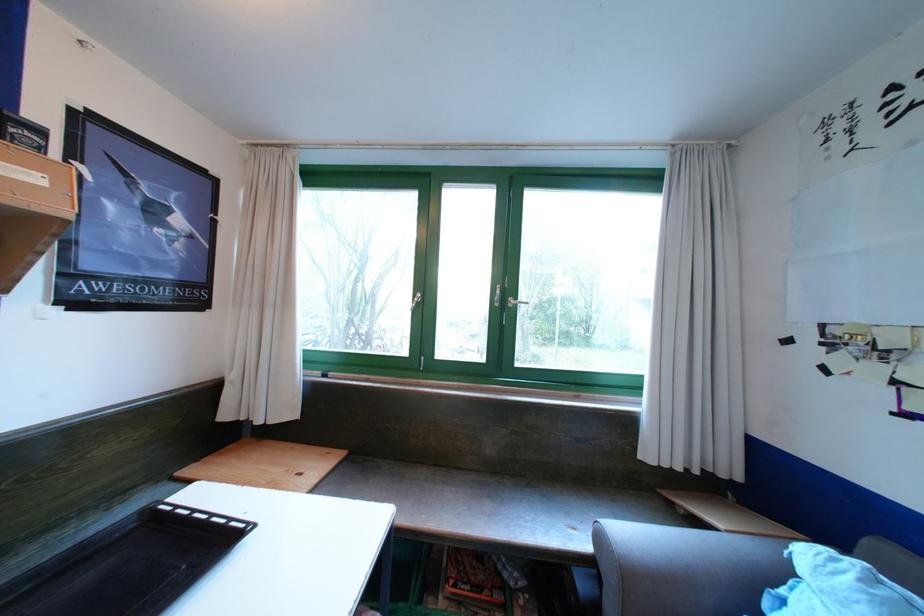
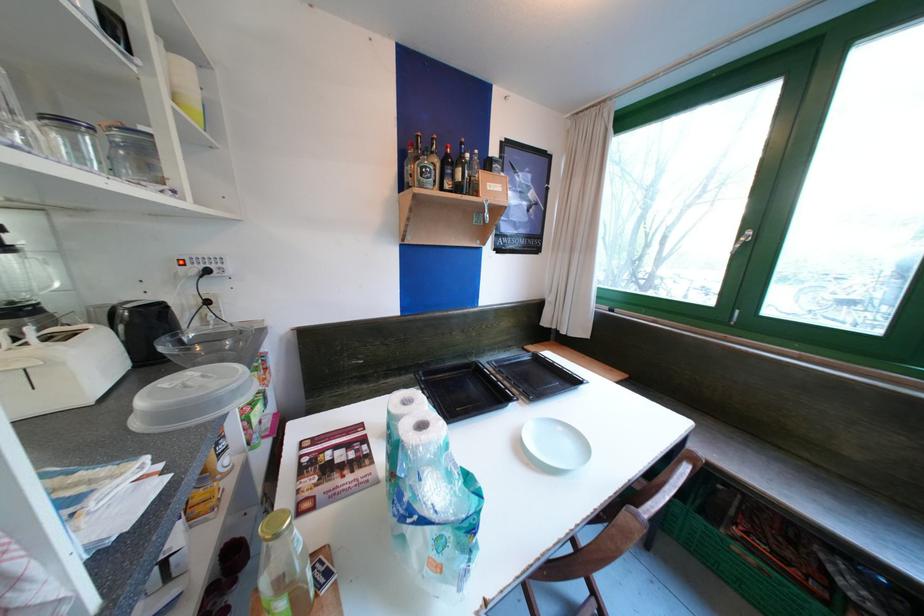
Question: The camera is either moving clockwise (left) or counter-clockwise (right) around the object. The first image is from the beginning of the video and the second image is from the end. Is the camera moving left or right when shooting the video?

Choices:
 (A) Left
 (B) Right

Answer: (B)